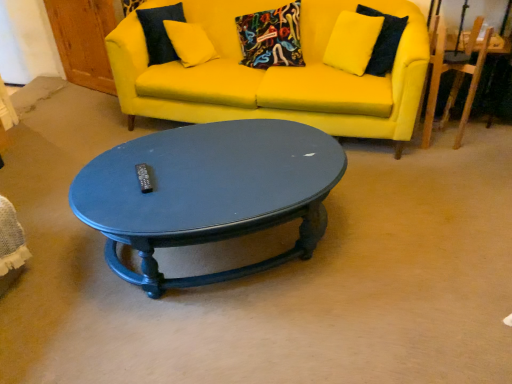
The width and height of the screenshot is (512, 384). Find the location of `vacant area in front of matte yellow fabric couch at upper center`. vacant area in front of matte yellow fabric couch at upper center is located at coordinates (330, 272).